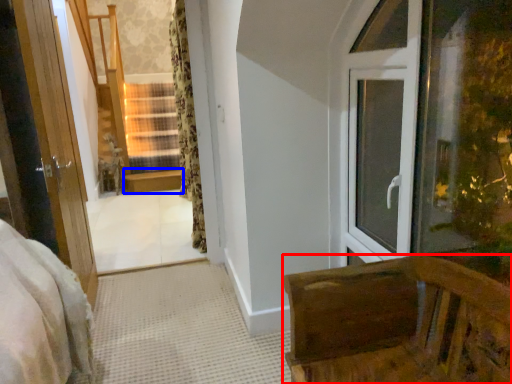
Question: Among these objects, which one is farthest to the camera, furniture (highlighted by a red box) or window sill (highlighted by a blue box)?

Choices:
 (A) furniture
 (B) window sill

Answer: (B)